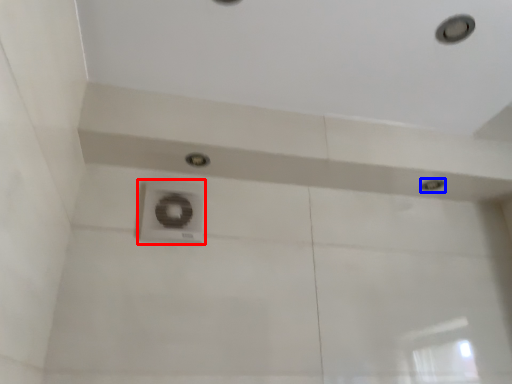
Question: Which point is further to the camera, plumbing fixture (highlighted by a red box) or droplight (highlighted by a blue box)?

Choices:
 (A) plumbing fixture
 (B) droplight

Answer: (B)